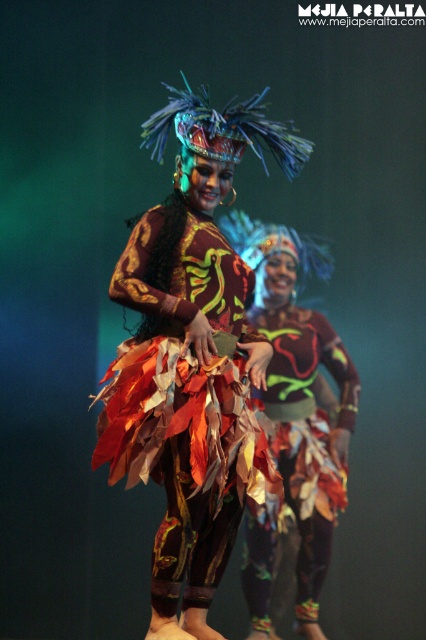
Question: Which point is farther to the camera?

Choices:
 (A) leaves fabric skirt at center
 (B) metallic leaf skirt at center

Answer: (A)

Question: In this image, where is metallic leaf skirt at center located relative to leaves fabric skirt at center?

Choices:
 (A) left
 (B) right

Answer: (A)

Question: Is metallic leaf skirt at center smaller than leaves fabric skirt at center?

Choices:
 (A) yes
 (B) no

Answer: (A)

Question: Can you confirm if metallic leaf skirt at center is positioned to the right of leaves fabric skirt at center?

Choices:
 (A) yes
 (B) no

Answer: (B)